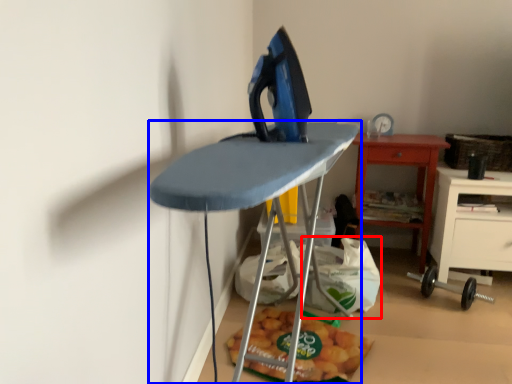
Question: Among these objects, which one is farthest to the camera, grocery bag (highlighted by a red box) or furniture (highlighted by a blue box)?

Choices:
 (A) grocery bag
 (B) furniture

Answer: (A)